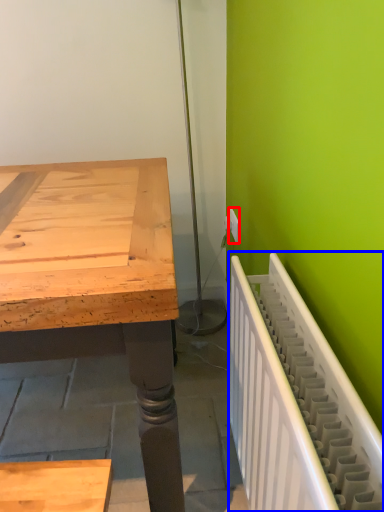
Question: Which object is closer to the camera taking this photo, electric outlet (highlighted by a red box) or radiator (highlighted by a blue box)?

Choices:
 (A) electric outlet
 (B) radiator

Answer: (B)